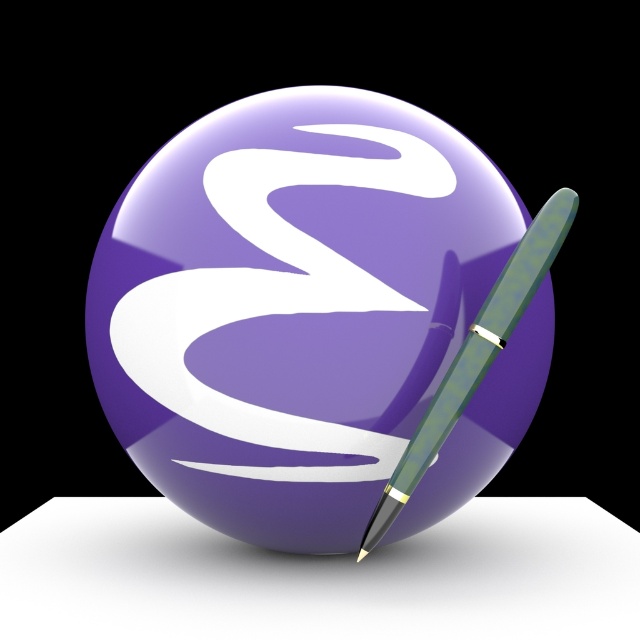
You are an artist trying to sketch the scene. You notice two points marked in the image. Which point is closer to you, point (200, 465) or point (404, 481)?

Point (404, 481) is closer to you because the Objects Description states that point (200, 465) is behind point (404, 481).

You are an artist trying to sketch the scene. You want to draw the glossy purple sphere at center and the translucent green fountain pen at right accurately. Which object should you draw first to maintain proper perspective?

You should draw the translucent green fountain pen at right first because it is farther away than the glossy purple sphere at center, so you should start with background elements before moving to closer objects.